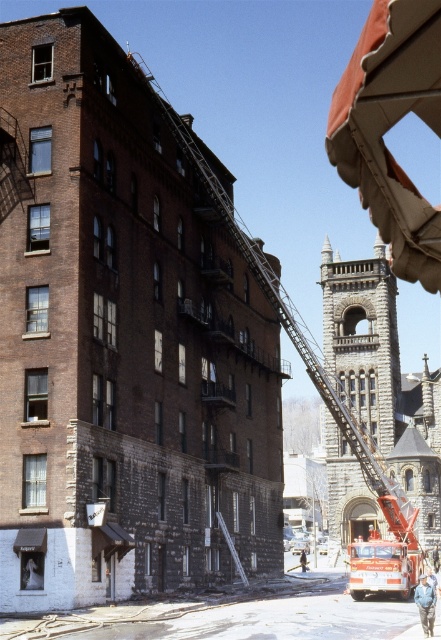
You are a delivery person trying to park your 2.5 meters wide van next to the red metallic fire truck at right and the light blue denim jacket at lower right. Based on their widths, which object should you avoid placing your van next to to ensure enough space?

The red metallic fire truck at right is wider than the light blue denim jacket at lower right. To ensure enough space, avoid placing the van next to the red metallic fire truck at right since it is wider.